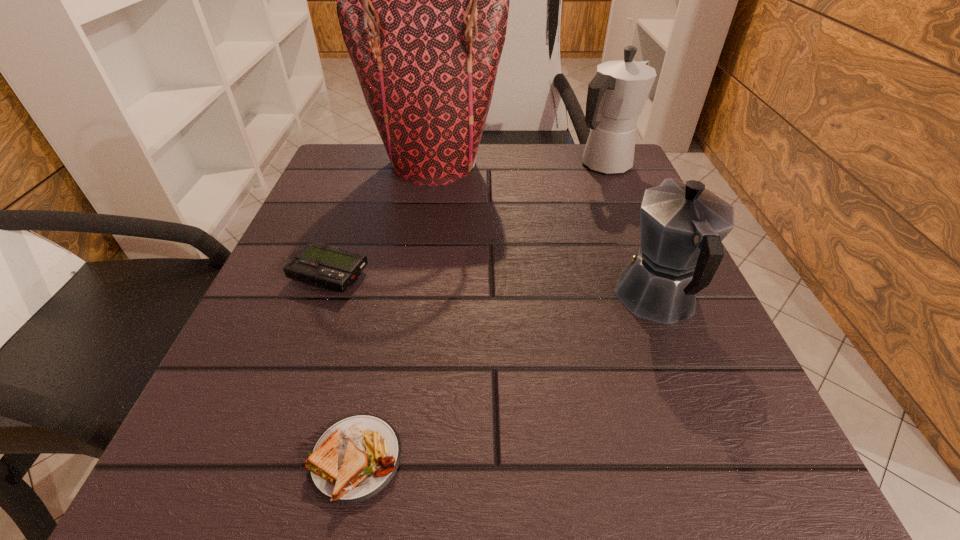
Identify the location of vacant space situated at the spout of the shorter coffeepot. pos(607,174).

Where is `free spot located at the spout of the shorter coffeepot`? Image resolution: width=960 pixels, height=540 pixels. free spot located at the spout of the shorter coffeepot is located at coordinates (615, 197).

Where is `vacant space located at the spout of the shorter coffeepot`? The image size is (960, 540). vacant space located at the spout of the shorter coffeepot is located at coordinates (598, 153).

You are a GUI agent. You are given a task and a screenshot of the screen. Output one action in this format:
    pyautogui.click(x=<x>, y=<y>)
    Task: Click on the vacant space located on the right of the fourth tallest object
    The width and height of the screenshot is (960, 540).
    Given the screenshot: What is the action you would take?
    pyautogui.click(x=470, y=275)

I want to click on free space located on the back of the sandwich, so [391, 296].

Where is `handbag that is at the far edge`? handbag that is at the far edge is located at coordinates [422, 0].

Where is `coffeepot that is at the far edge`? The height and width of the screenshot is (540, 960). coffeepot that is at the far edge is located at coordinates (616, 95).

Image resolution: width=960 pixels, height=540 pixels. I want to click on object located in the near edge section of the desktop, so click(x=355, y=458).

At what (x,y) coordinates should I click in order to perform the action: click on handbag located at the left edge. Please return your answer as a coordinate pair (x, y). Looking at the image, I should click on (422, 0).

Locate an element on the screen. Image resolution: width=960 pixels, height=540 pixels. beeper located at the left edge is located at coordinates (326, 266).